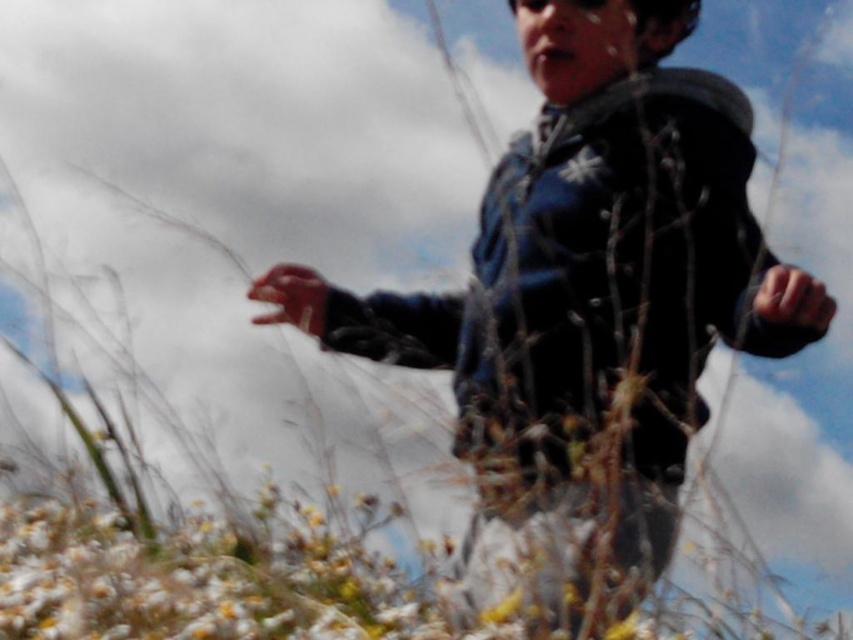
In the scene shown: You are a photographer trying to capture the person in the image. The camera you are using has a focus point at coordinate point (604, 257). What object is the camera focusing on?

The point (604, 257) marks the dark blue jacket at center, so the camera is focusing on the dark blue jacket at center.

You are a photographer trying to capture the dark blue jacket at center in the image. What are the coordinates where you should focus your camera?

The coordinates for the dark blue jacket at center are at point (604, 257).